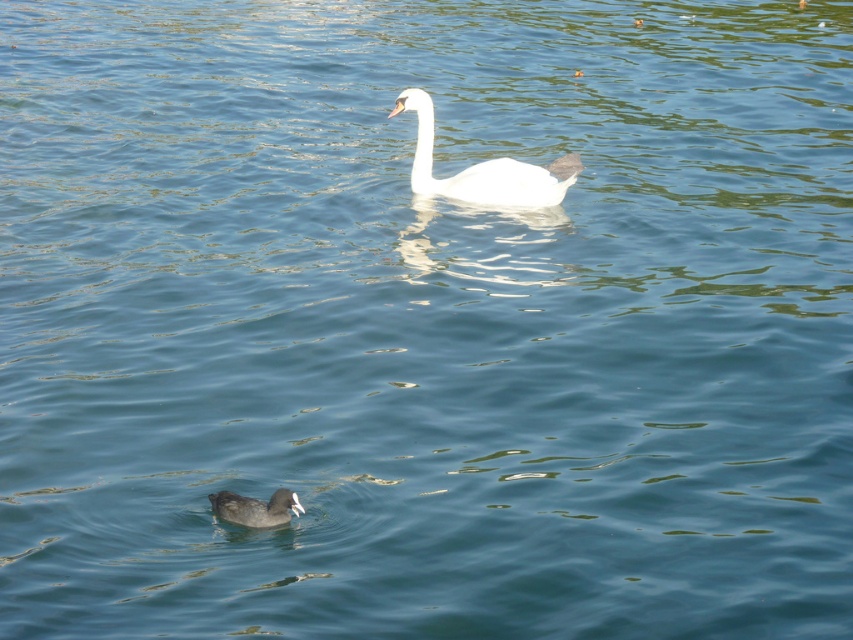
Question: Does white glossy swan at upper center have a greater width compared to dark brown matte duck at lower left?

Choices:
 (A) yes
 (B) no

Answer: (A)

Question: Does white glossy swan at upper center have a smaller size compared to dark brown matte duck at lower left?

Choices:
 (A) yes
 (B) no

Answer: (B)

Question: Among these objects, which one is farthest from the camera?

Choices:
 (A) dark brown matte duck at lower left
 (B) white glossy swan at upper center

Answer: (B)

Question: Can you confirm if white glossy swan at upper center is smaller than dark brown matte duck at lower left?

Choices:
 (A) no
 (B) yes

Answer: (A)